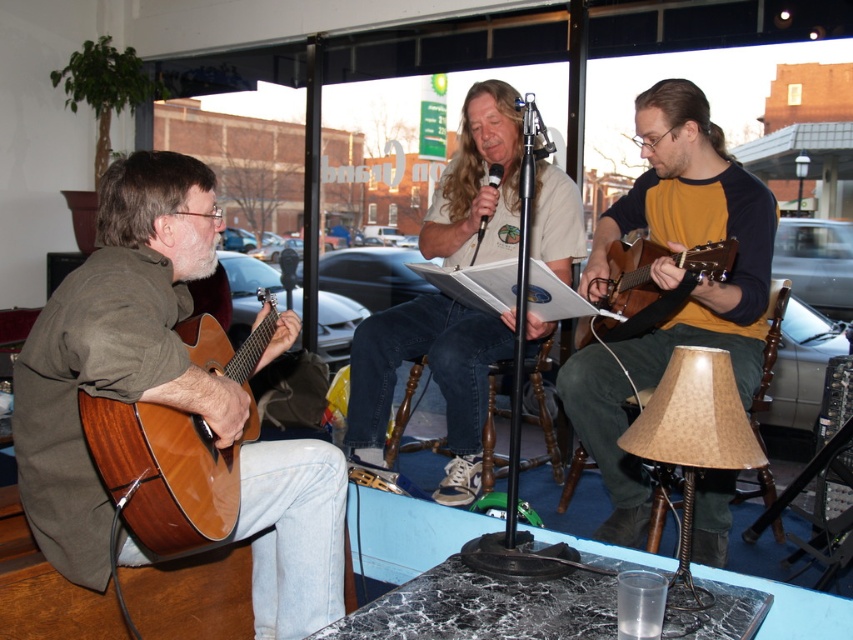
Question: Is matte brown guitar at center below beige cotton shirt at center?

Choices:
 (A) yes
 (B) no

Answer: (A)

Question: Is matte brown guitar at center to the right of shiny brown acoustic guitar at left from the viewer's perspective?

Choices:
 (A) no
 (B) yes

Answer: (B)

Question: Based on their relative distances, which object is nearer to the matte brown guitar at center?

Choices:
 (A) shiny brown acoustic guitar at left
 (B) burlap lampshade at lower right
 (C) beige cotton shirt at center

Answer: (C)

Question: Which object is positioned farthest from the matte brown guitar at center?

Choices:
 (A) beige cotton shirt at center
 (B) matte brown acoustic guitar at right
 (C) matte brown guitar at left

Answer: (C)

Question: Does matte brown guitar at center appear on the right side of burlap lampshade at lower right?

Choices:
 (A) yes
 (B) no

Answer: (A)

Question: Which of the following is the closest to the observer?

Choices:
 (A) matte brown acoustic guitar at right
 (B) matte brown guitar at left
 (C) shiny brown acoustic guitar at left
 (D) burlap lampshade at lower right

Answer: (B)